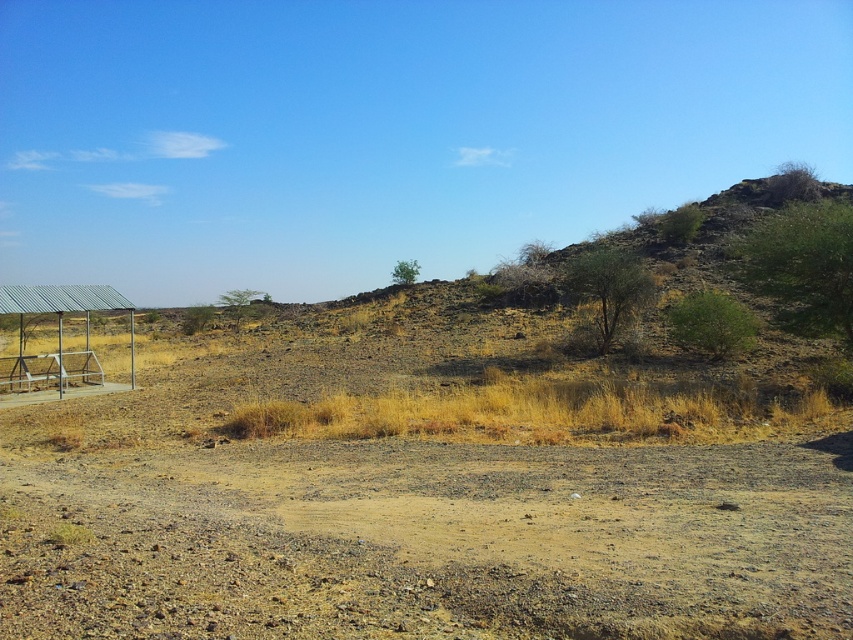
Is brown gravel dirt track at center to the left of metallic roof at left from the viewer's perspective?

Incorrect, brown gravel dirt track at center is not on the left side of metallic roof at left.

Is point (669, 465) in front of point (80, 371)?

Yes, point (669, 465) is in front of point (80, 371).

Where is `brown gravel dirt track at center`? This screenshot has height=640, width=853. brown gravel dirt track at center is located at coordinates (430, 541).

This screenshot has height=640, width=853. Find the location of `brown gravel dirt track at center`. brown gravel dirt track at center is located at coordinates (430, 541).